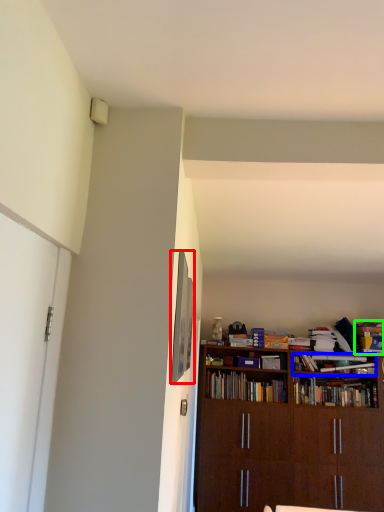
Question: Which is nearer to the picture frame (highlighted by a red box)? book (highlighted by a blue box) or book (highlighted by a green box).

Choices:
 (A) book
 (B) book

Answer: (A)